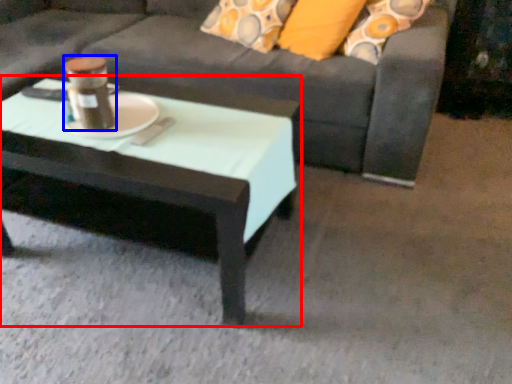
Question: Which object appears closest to the camera in this image, coffee table (highlighted by a red box) or beverage (highlighted by a blue box)?

Choices:
 (A) coffee table
 (B) beverage

Answer: (A)